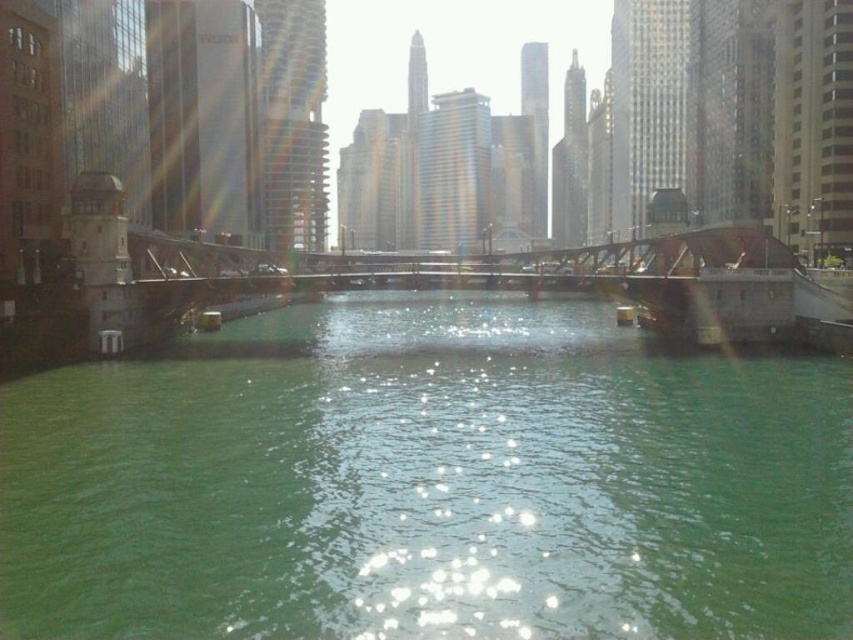
Where is `green water at center`? The image size is (853, 640). green water at center is located at coordinates (428, 483).

Between green water at center and metallic bridge at center, which one appears on the left side from the viewer's perspective?

Positioned to the left is metallic bridge at center.

Describe the element at coordinates (428, 483) in the screenshot. I see `green water at center` at that location.

Where is `green water at center`? green water at center is located at coordinates (428, 483).

Based on the photo, does metallic bridge at center appear on the left side of metallic brown bridge at right?

Correct, you'll find metallic bridge at center to the left of metallic brown bridge at right.

Measure the distance from metallic bridge at center to metallic brown bridge at right.

16.20 feet

Find the location of a particular element. This screenshot has width=853, height=640. metallic bridge at center is located at coordinates (550, 280).

Identify the location of metallic bridge at center. The image size is (853, 640). (550, 280).

Can you confirm if green water at center is thinner than metallic brown bridge at right?

No, green water at center is not thinner than metallic brown bridge at right.

Which is in front, point (33, 513) or point (796, 304)?

Point (33, 513)

Who is more distant from viewer, (248,611) or (680,266)?

The point (680,266) is behind.

Locate an element on the screen. The width and height of the screenshot is (853, 640). green water at center is located at coordinates (428, 483).